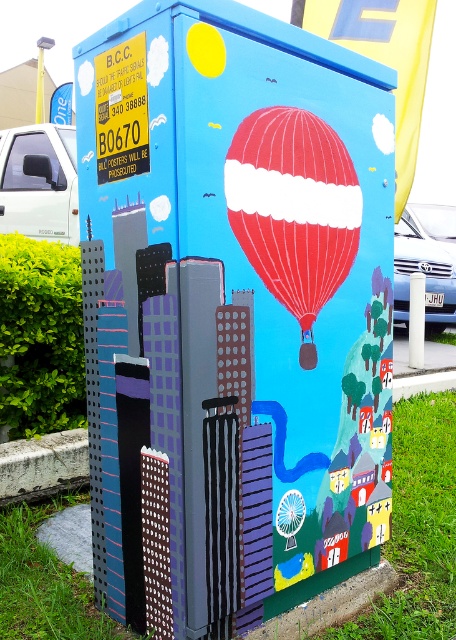
Question: Does matte blue building at center appear on the right side of red glossy hot air balloon at center?

Choices:
 (A) no
 (B) yes

Answer: (A)

Question: Can you confirm if matte blue building at center is bigger than red glossy hot air balloon at center?

Choices:
 (A) yes
 (B) no

Answer: (A)

Question: Among these objects, which one is nearest to the camera?

Choices:
 (A) red glossy hot air balloon at center
 (B) matte blue building at center

Answer: (B)

Question: Is matte blue building at center further to camera compared to red glossy hot air balloon at center?

Choices:
 (A) yes
 (B) no

Answer: (B)

Question: Which point is closer to the camera?

Choices:
 (A) matte blue building at center
 (B) red glossy hot air balloon at center

Answer: (A)

Question: Among these points, which one is farthest from the camera?

Choices:
 (A) (383, 234)
 (B) (247, 177)

Answer: (A)